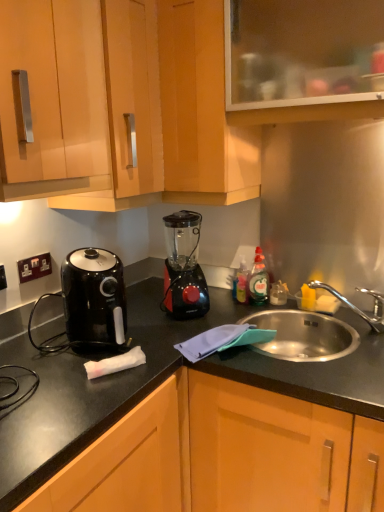
Question: Does point (286, 425) appear closer or farther from the camera than point (0, 278)?

Choices:
 (A) closer
 (B) farther

Answer: (A)

Question: From a real-world perspective, is wooden cabinet at lower center, which appears as the 5th cabinetry when viewed from the top, above or below black plastic electric outlet at lower left, which ranks as the 1th electric outlet in left-to-right order?

Choices:
 (A) below
 (B) above

Answer: (A)

Question: Considering the real-world distances, which object is farthest from the black glossy air fryer at left?

Choices:
 (A) transparent glass cabinet at upper center, placed as the 1th cabinetry when sorted from top to bottom
 (B) black plastic electrical outlet at left, the first electric outlet viewed from the right
 (C) wooden cabinet at upper center, arranged as the second cabinetry when viewed from the top
 (D) matte wood cabinet at upper left, the fourth cabinetry when ordered from top to bottom
 (E) black plastic blender at center

Answer: (A)

Question: Which object is the farthest from the transparent glass cabinet at upper center, placed as the 1th cabinetry when sorted from top to bottom?

Choices:
 (A) black plastic electrical outlet at left, arranged as the first electric outlet when viewed from the back
 (B) black glossy air fryer at left
 (C) matte wood cabinet at upper left, which is the second cabinetry from bottom to top
 (D) wooden cabinet at lower center, which appears as the 1th cabinetry when ordered from the bottom
 (E) matte wood cabinets at upper center, the third cabinetry from the top

Answer: (A)